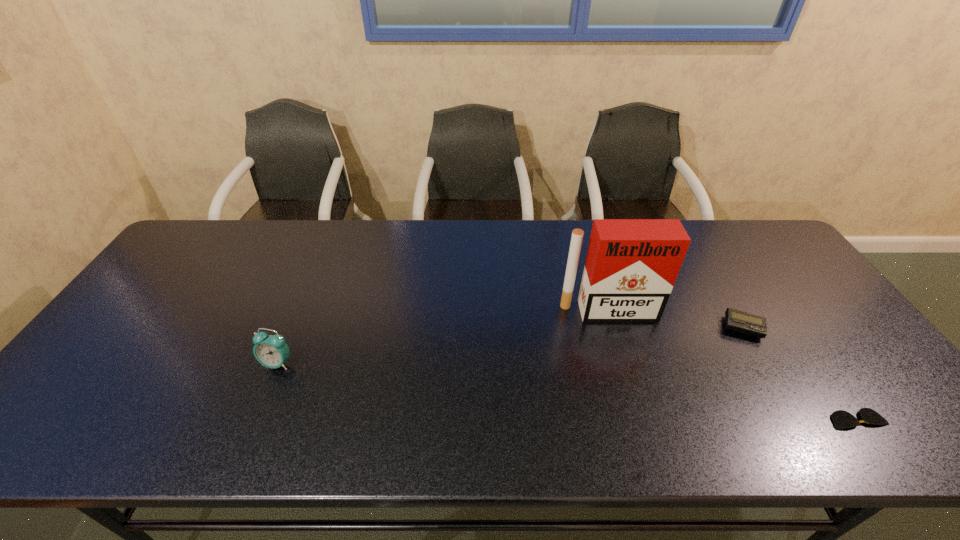
The height and width of the screenshot is (540, 960). I want to click on blank space located on the back of the third tallest object, so click(x=726, y=299).

The height and width of the screenshot is (540, 960). Identify the location of free space located 0.060m on the back of the nearest object. (834, 387).

Find the location of a particular element. Image resolution: width=960 pixels, height=540 pixels. object situated at the near edge is located at coordinates (842, 419).

Locate an element on the screen. The height and width of the screenshot is (540, 960). object that is at the right edge is located at coordinates (842, 419).

This screenshot has width=960, height=540. I want to click on object positioned at the near right corner, so click(x=842, y=419).

This screenshot has height=540, width=960. What are the coordinates of `free space at the far edge of the desktop` in the screenshot? It's located at (481, 222).

At what (x,y) coordinates should I click in order to perform the action: click on vacant space at the near edge of the desktop. Please return your answer as a coordinate pair (x, y). Looking at the image, I should click on (182, 446).

Image resolution: width=960 pixels, height=540 pixels. Identify the location of vacant region at the left edge of the desktop. (150, 308).

Find the location of `vacant region at the right edge of the desktop`. vacant region at the right edge of the desktop is located at coordinates (888, 378).

The width and height of the screenshot is (960, 540). In the image, there is a desktop. In order to click on vacant space at the far left corner in this screenshot , I will do `click(245, 219)`.